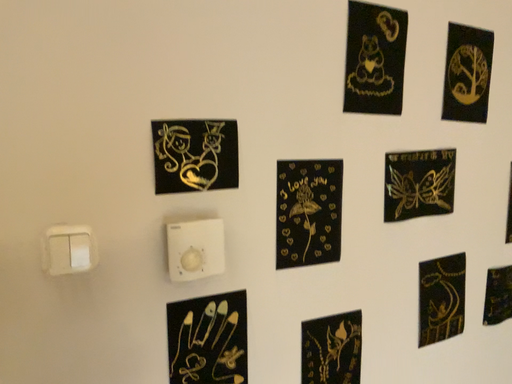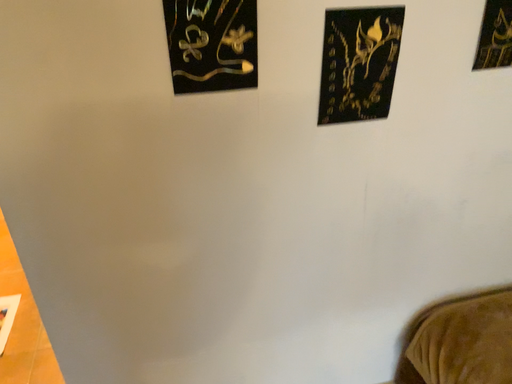
Question: How did the camera likely rotate when shooting the video?

Choices:
 (A) rotated upward
 (B) rotated downward

Answer: (B)